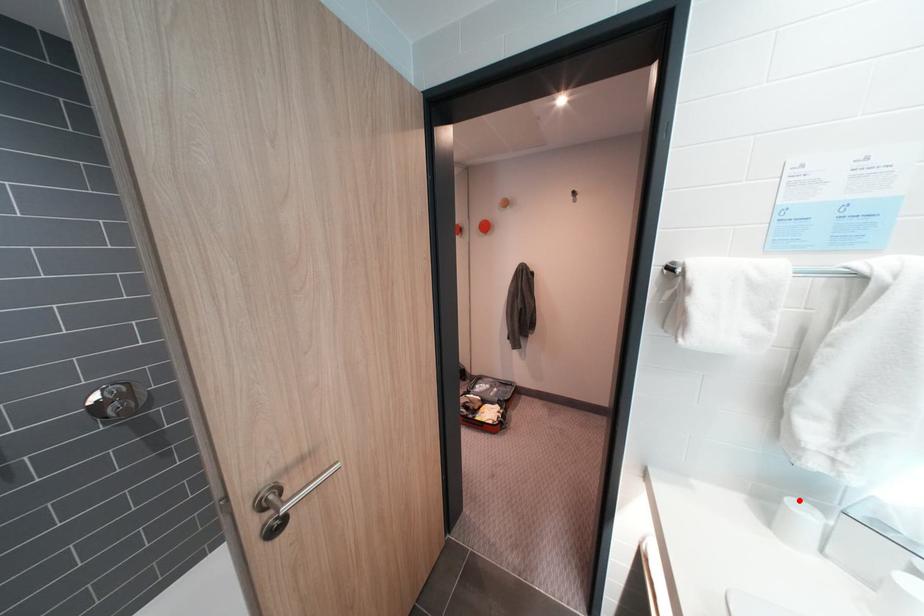
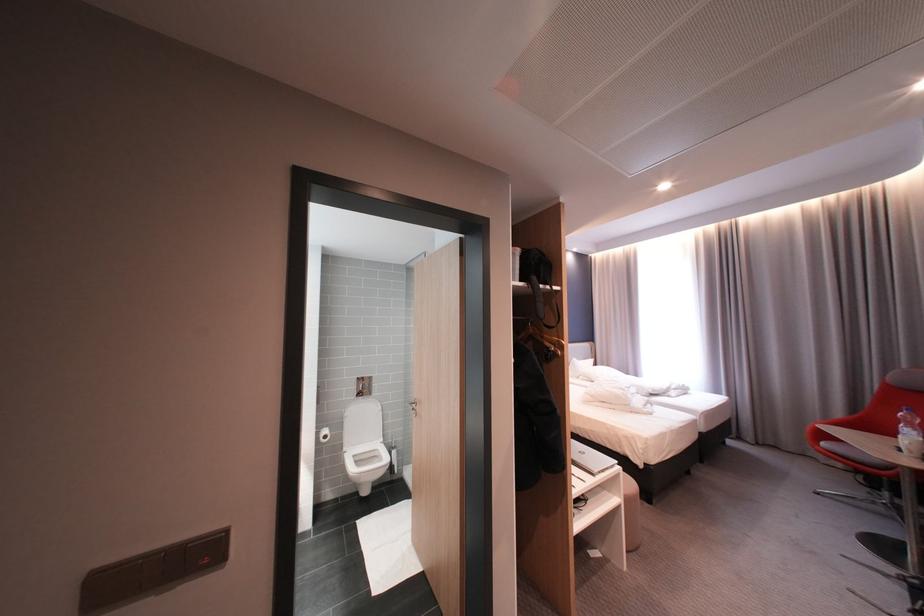
Question: I am providing you with two images of the same scene from different viewpoints. A red point is marked on the first image. At the location where the point appears in image 1, is it still visible in image 2?

Choices:
 (A) Yes
 (B) No

Answer: (B)